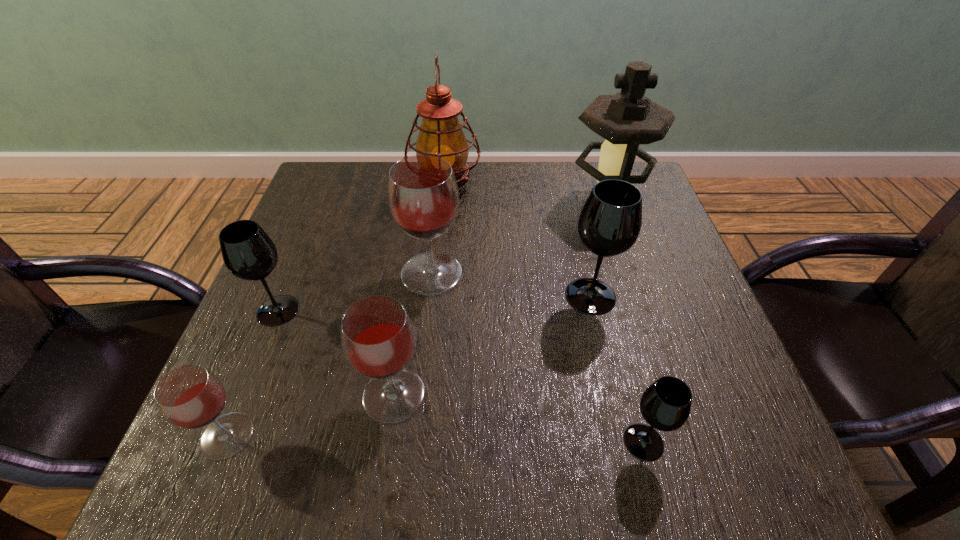
Find the location of a particular element. The width and height of the screenshot is (960, 540). vacant space that is in between the leftmost red wineglass and the second biggest red wineglass is located at coordinates (310, 415).

This screenshot has width=960, height=540. I want to click on vacant area that lies between the nearest gray wineglass and the biggest gray wineglass, so click(x=617, y=369).

Locate an element on the screen. The height and width of the screenshot is (540, 960). empty location between the leftmost red wineglass and the biggest red wineglass is located at coordinates (329, 355).

In order to click on object that is the third closest to the farthest red wineglass in this screenshot , I will do `click(248, 252)`.

The height and width of the screenshot is (540, 960). Find the location of `object that is the fifth closest one to the second smallest red wineglass`. object that is the fifth closest one to the second smallest red wineglass is located at coordinates (665, 405).

Identify which wineglass is located as the second nearest to the biggest gray wineglass. Please provide its 2D coordinates. Your answer should be formatted as a tuple, i.e. [(x, y)], where the tuple contains the x and y coordinates of a point satisfying the conditions above.

[(665, 405)]

Where is `wineglass that is the third closest to the smallest red wineglass`? wineglass that is the third closest to the smallest red wineglass is located at coordinates (422, 193).

Locate an element on the screen. Image resolution: width=960 pixels, height=540 pixels. red wineglass that is the third closest to the right oil lamp is located at coordinates (190, 397).

Select which red wineglass appears as the second closest to the second biggest red wineglass. Please provide its 2D coordinates. Your answer should be formatted as a tuple, i.e. [(x, y)], where the tuple contains the x and y coordinates of a point satisfying the conditions above.

[(422, 193)]

Locate an element on the screen. gray wineglass that is the second closest one to the biggest gray wineglass is located at coordinates (248, 252).